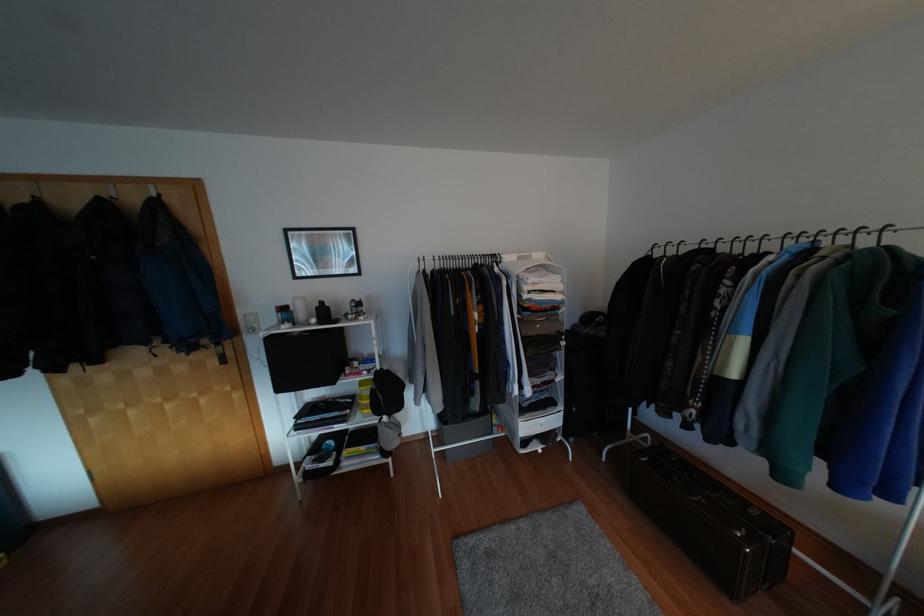
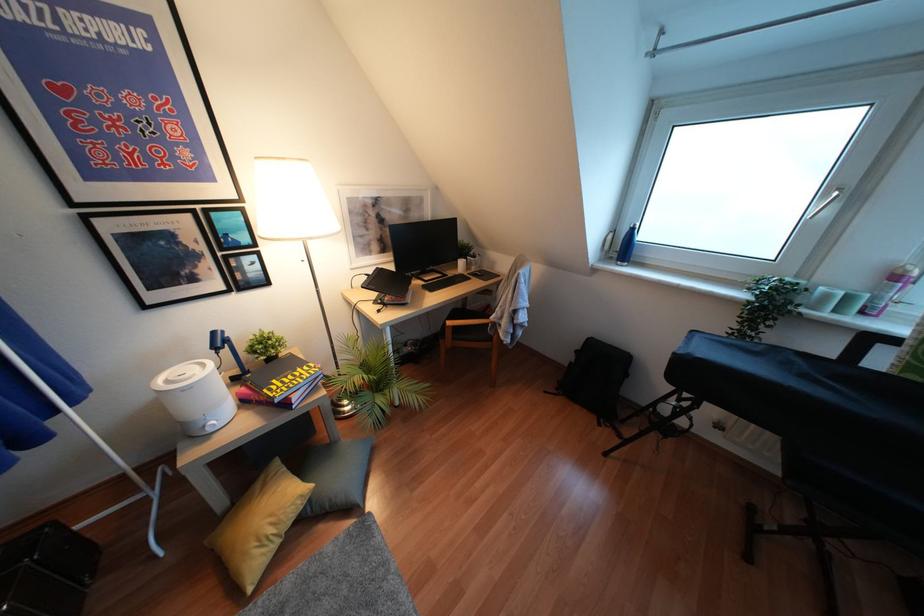
First-person continuous shooting, in which direction is the camera rotating?

The camera's rotation is toward right-down.